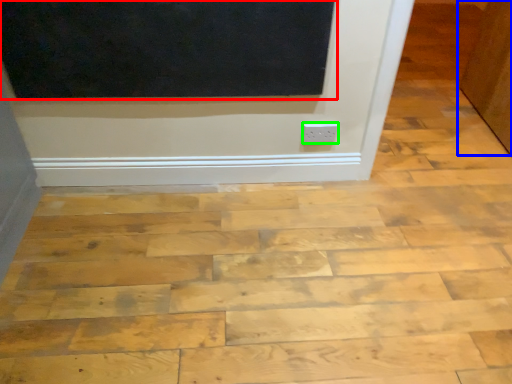
Question: Considering the real-world distances, which object is farthest from screen door (highlighted by a red box)? door (highlighted by a blue box) or electric outlet (highlighted by a green box)?

Choices:
 (A) door
 (B) electric outlet

Answer: (A)